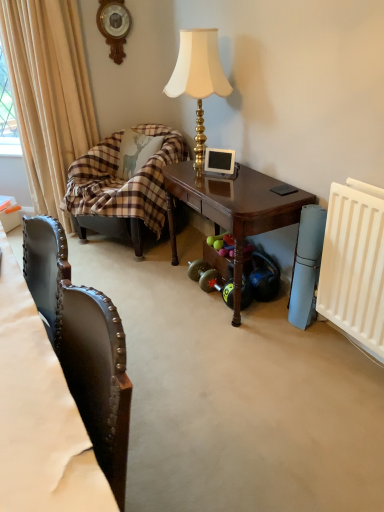
This screenshot has height=512, width=384. Find the location of `beige fabric curtain at left`. beige fabric curtain at left is located at coordinates (48, 94).

The height and width of the screenshot is (512, 384). Describe the element at coordinates (48, 94) in the screenshot. I see `beige fabric curtain at left` at that location.

In order to face plaid fabric couch at left, should I rotate leftwards or rightwards?

A 8.268 degree turn to the left will do.

This screenshot has height=512, width=384. Describe the element at coordinates (198, 77) in the screenshot. I see `gold textured lamp at upper center` at that location.

The image size is (384, 512). Describe the element at coordinates (83, 345) in the screenshot. I see `leather at left` at that location.

Describe the element at coordinates (233, 208) in the screenshot. The height and width of the screenshot is (512, 384). I see `dark wood table at center` at that location.

Identify the location of rubberized black dumbbell at lower right. The image size is (384, 512). [x=264, y=276].

Find the location of a particular element. beige fabric curtain at left is located at coordinates (48, 94).

From the image's perspective, is leather at left on plaid fabric couch at left?

No, from the image's perspective, leather at left is not above plaid fabric couch at left.

Considering the relative sizes of leather at left and plaid fabric couch at left in the image provided, is leather at left smaller than plaid fabric couch at left?

Correct, leather at left occupies less space than plaid fabric couch at left.

Which object is positioned more to the right, leather at left or plaid fabric couch at left?

plaid fabric couch at left is more to the right.

Does point (58, 297) come closer to viewer compared to point (86, 167)?

That is True.

Is gold textured lamp at upper center completely or partially outside of leather at left?

That's correct, gold textured lamp at upper center is outside of leather at left.

How different are the orientations of gold textured lamp at upper center and leather at left in degrees?

The facing directions of gold textured lamp at upper center and leather at left are 92.6 degrees apart.

Could you tell me if gold textured lamp at upper center is turned towards leather at left?

No, gold textured lamp at upper center is not turned towards leather at left.

Does plaid fabric couch at left contain beige fabric curtain at left?

No, plaid fabric couch at left does not contain beige fabric curtain at left.

Can you tell me how much plaid fabric couch at left and beige fabric curtain at left differ in facing direction?

The angular difference between plaid fabric couch at left and beige fabric curtain at left is 15.1 degrees.

Identify the location of curtain on the left of plaid fabric couch at left. (48, 94).

From a real-world perspective, which is physically below, beige fabric curtain at left or leather at left?

leather at left is physically lower.

Considering the relative sizes of beige fabric curtain at left and leather at left in the image provided, is beige fabric curtain at left thinner than leather at left?

Yes.

Which of these two, beige fabric curtain at left or leather at left, is bigger?

beige fabric curtain at left.

Is beige fabric curtain at left looking in the opposite direction of leather at left?

No, beige fabric curtain at left is not facing the opposite direction of leather at left.

From the image's perspective, which object appears higher, rubberized black dumbbell at lower right or white plastic radiator at right?

white plastic radiator at right is shown above in the image.

Is rubberized black dumbbell at lower right not near white plastic radiator at right?

rubberized black dumbbell at lower right is near white plastic radiator at right, not far away.

From their relative heights in the image, would you say rubberized black dumbbell at lower right is taller or shorter than white plastic radiator at right?

rubberized black dumbbell at lower right is shorter than white plastic radiator at right.

Is rubberized black dumbbell at lower right thinner than white plastic radiator at right?

No, rubberized black dumbbell at lower right is not thinner than white plastic radiator at right.

Can you confirm if gold textured lamp at upper center is positioned to the right of plaid fabric couch at left?

Correct, you'll find gold textured lamp at upper center to the right of plaid fabric couch at left.

Which point is more forward, (200, 57) or (161, 202)?

The point (200, 57) is closer.

Which of these two, gold textured lamp at upper center or plaid fabric couch at left, is thinner?

gold textured lamp at upper center.

Considering the positions of objects gold textured lamp at upper center and plaid fabric couch at left in the image provided, who is in front, gold textured lamp at upper center or plaid fabric couch at left?

Positioned in front is gold textured lamp at upper center.

Is white plastic radiator at right bigger than beige fabric curtain at left?

No, white plastic radiator at right is not bigger than beige fabric curtain at left.

Is there a large distance between white plastic radiator at right and beige fabric curtain at left?

white plastic radiator at right is positioned a significant distance from beige fabric curtain at left.

From the image's perspective, is white plastic radiator at right on top of beige fabric curtain at left?

No.

You are a GUI agent. You are given a task and a screenshot of the screen. Output one action in this format:
    pyautogui.click(x=<x>, y=<y>)
    Task: Click on the radiator on the right of beige fabric curtain at left
    This screenshot has width=384, height=512.
    Given the screenshot: What is the action you would take?
    pyautogui.click(x=354, y=266)

Image resolution: width=384 pixels, height=512 pixels. I want to click on studio couch above the leather at left (from the image's perspective), so click(122, 188).

Where is `lamp on the right of leather at left`? The width and height of the screenshot is (384, 512). lamp on the right of leather at left is located at coordinates (198, 77).

Looking at this image, based on their spatial positions, is leather at left or plaid fabric couch at left closer to white plastic radiator at right?

leather at left lies closer to white plastic radiator at right than the other object.

Estimate the real-world distances between objects in this image. Which object is closer to dark wood table at center, rubberized black dumbbell at lower right or beige fabric curtain at left?

rubberized black dumbbell at lower right is closer to dark wood table at center.

When comparing their distances from rubberized black dumbbell at lower right, does leather at left or gold textured lamp at upper center seem closer?

gold textured lamp at upper center is closer to rubberized black dumbbell at lower right.

Looking at the image, which one is located closer to white plastic radiator at right, rubberized black dumbbell at lower right or plaid fabric couch at left?

rubberized black dumbbell at lower right.

From the image, which object appears to be farther from leather at left, beige fabric curtain at left or rubberized black dumbbell at lower right?

beige fabric curtain at left.

From the image, which object appears to be nearer to gold textured lamp at upper center, dark wood table at center or leather at left?

dark wood table at center is positioned closer to the anchor gold textured lamp at upper center.

Which object lies nearer to the anchor point plaid fabric couch at left, beige fabric curtain at left or rubberized black dumbbell at lower right?

beige fabric curtain at left is positioned closer to the anchor plaid fabric couch at left.

Considering their positions, is gold textured lamp at upper center positioned closer to dark wood table at center than plaid fabric couch at left?

Based on the image, plaid fabric couch at left appears to be nearer to dark wood table at center.

This screenshot has width=384, height=512. Find the location of `table between plaid fabric couch at left and white plastic radiator at right`. table between plaid fabric couch at left and white plastic radiator at right is located at coordinates (233, 208).

You are a GUI agent. You are given a task and a screenshot of the screen. Output one action in this format:
    pyautogui.click(x=<x>, y=<y>)
    Task: Click on the studio couch between beige fabric curtain at left and rubberized black dumbbell at lower right from left to right
    The width and height of the screenshot is (384, 512).
    Given the screenshot: What is the action you would take?
    pyautogui.click(x=122, y=188)

Locate an element on the screen. Image resolution: width=384 pixels, height=512 pixels. radiator between leather at left and beige fabric curtain at left along the z-axis is located at coordinates click(354, 266).

Identify the location of lamp between leather at left and plaid fabric couch at left from front to back. This screenshot has height=512, width=384. (198, 77).